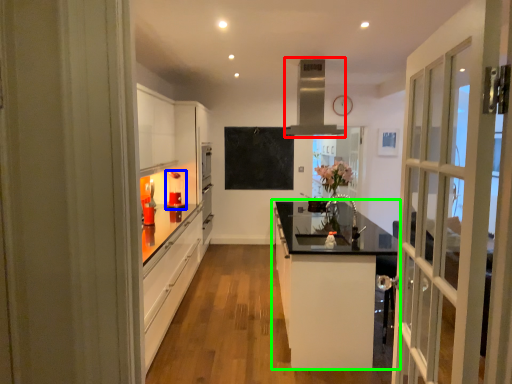
Question: Based on their relative distances, which object is nearer to exhaust hood (highlighted by a red box)? Choose from appliance (highlighted by a blue box) and cabinetry (highlighted by a green box).

Choices:
 (A) appliance
 (B) cabinetry

Answer: (B)